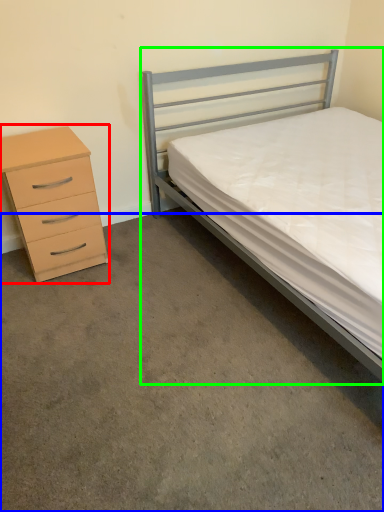
Question: Which is nearer to the chest of drawers (highlighted by a red box)? concrete (highlighted by a blue box) or bed (highlighted by a green box).

Choices:
 (A) concrete
 (B) bed

Answer: (A)